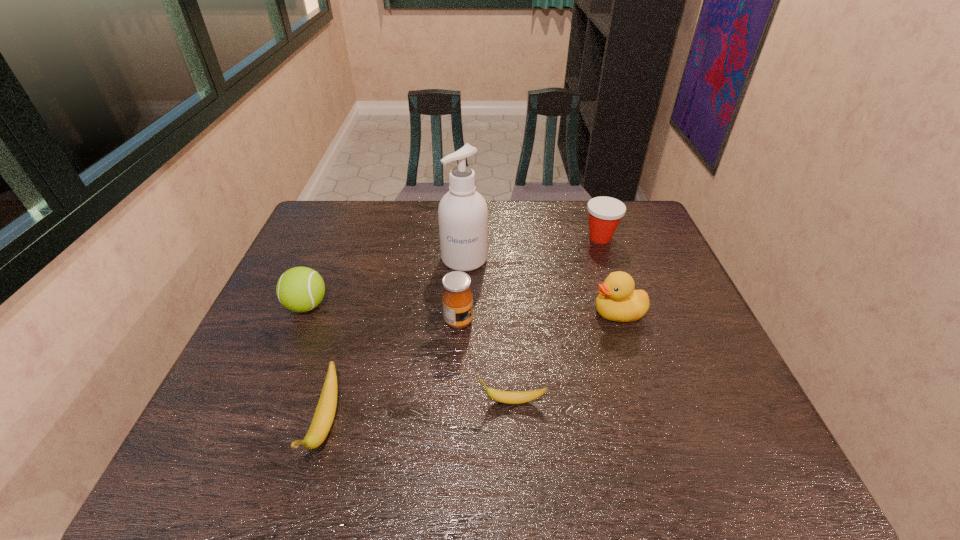
You are a GUI agent. You are given a task and a screenshot of the screen. Output one action in this format:
    pyautogui.click(x=<x>, y=<y>)
    Task: Click on the free space located at the stem of the shortest object
    The image size is (960, 540).
    Given the screenshot: What is the action you would take?
    pyautogui.click(x=329, y=401)

Locate an element on the screen. blank space located 0.320m at the stem of the shortest object is located at coordinates (333, 401).

Find the location of a particular element. Image resolution: width=960 pixels, height=540 pixels. free location located on the left of the Dixie cup is located at coordinates (478, 238).

Locate an element on the screen. This screenshot has height=540, width=960. blank space located on the front-facing side of the honey is located at coordinates (572, 321).

The width and height of the screenshot is (960, 540). I want to click on vacant space located on the back of the leftmost object, so click(x=325, y=262).

The width and height of the screenshot is (960, 540). In order to click on vacant space located 0.250m on the front label of the cleansing agent in this screenshot , I will do `click(461, 338)`.

In order to click on vacant region located 0.300m at the beak of the duck in this screenshot , I will do `click(479, 313)`.

Where is `free region located 0.260m at the beak of the duck`? Image resolution: width=960 pixels, height=540 pixels. free region located 0.260m at the beak of the duck is located at coordinates (494, 313).

Locate an element on the screen. vacant space located 0.370m at the beak of the duck is located at coordinates (453, 313).

In order to click on object at the far edge in this screenshot , I will do `click(605, 213)`.